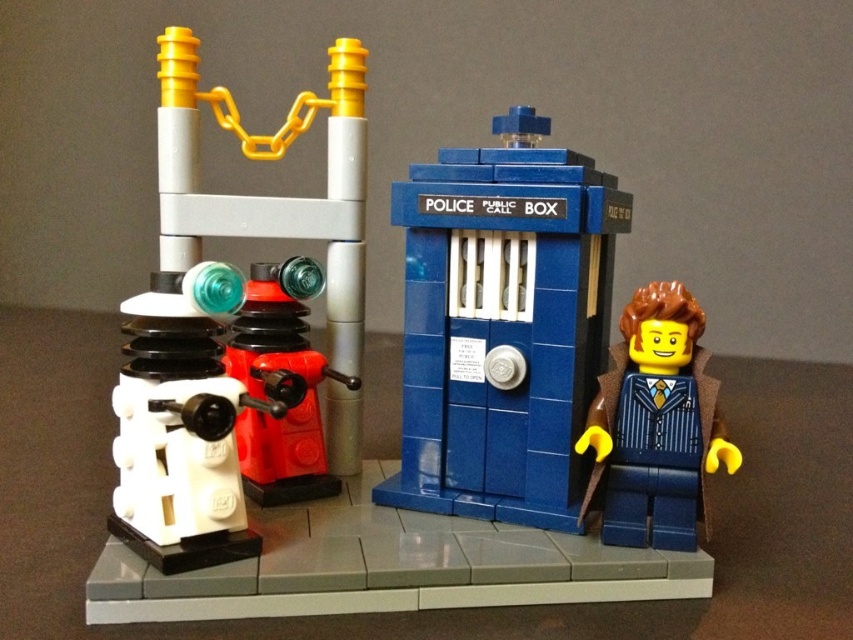
You are a visitor standing in front of the LEGO diorama. You notice the blue plastic police box at center and the blue glossy suit at right. Which object is wider?

The blue plastic police box at center is wider than the blue glossy suit at right.